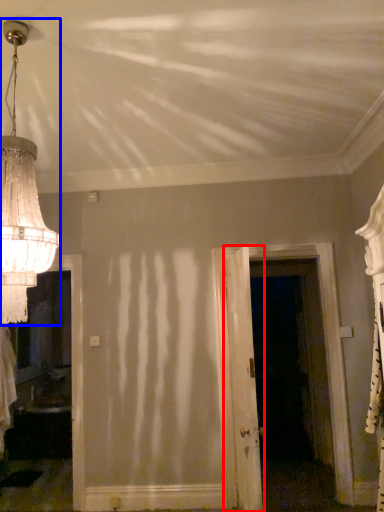
Question: Which point is closer to the camera, door (highlighted by a red box) or lamp (highlighted by a blue box)?

Choices:
 (A) door
 (B) lamp

Answer: (B)